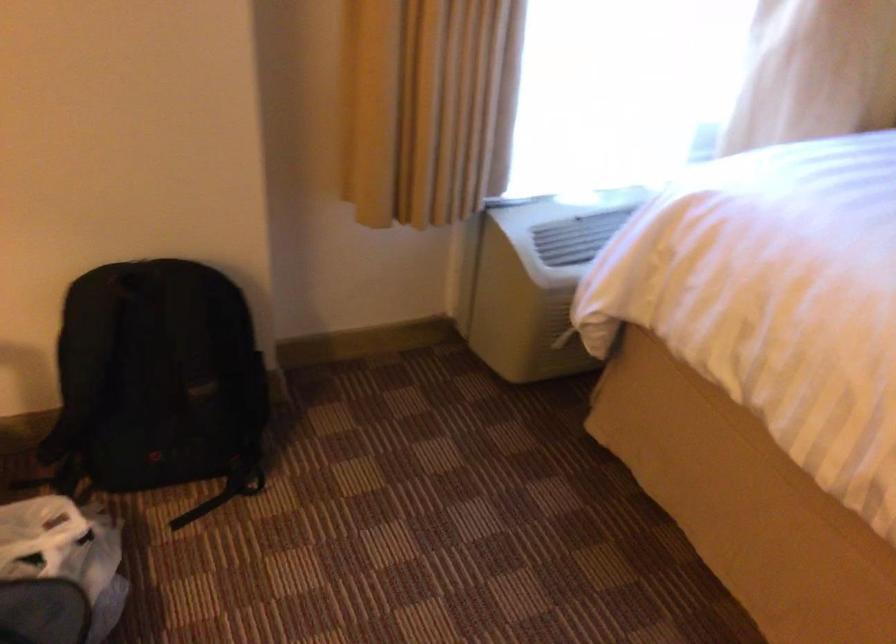
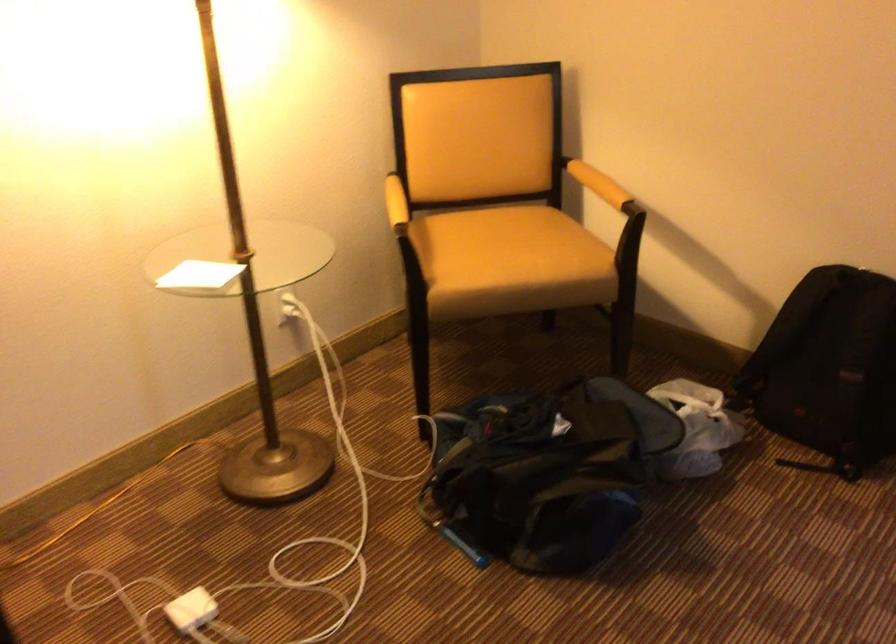
Question: I am providing you with two images of the same scene from different viewpoints. After the viewpoint changes to image2, which objects are now occluded?

Choices:
 (A) yellow chair armrest
 (B) white paper card
 (C) white plastic bag
 (D) none of these

Answer: (D)